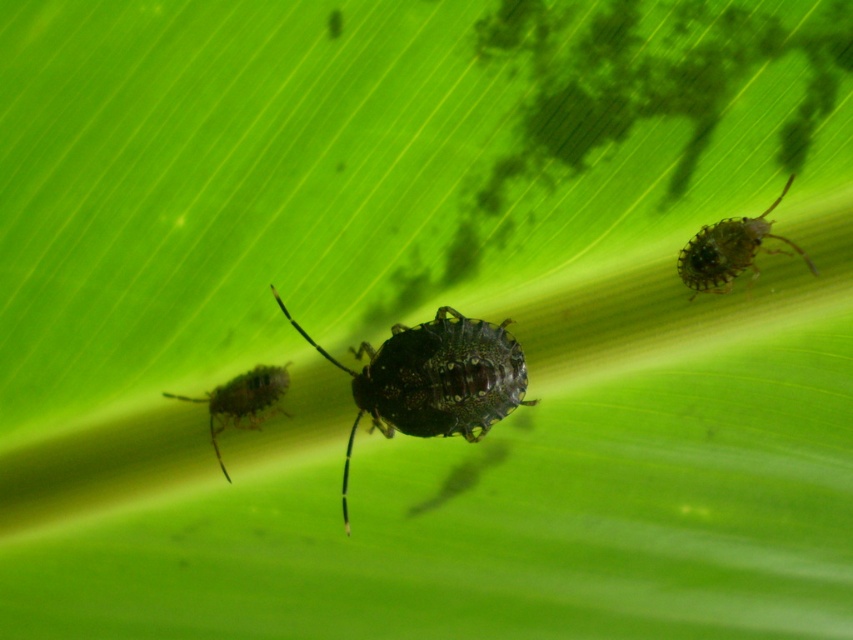
Question: Which object is farther from the camera taking this photo?

Choices:
 (A) shiny brown bug at lower left
 (B) shiny dark green bug at upper right

Answer: (A)

Question: Is shiny dark green bug at upper right further to camera compared to shiny brown bug at lower left?

Choices:
 (A) yes
 (B) no

Answer: (B)

Question: Can you confirm if shiny dark green bug at center is wider than shiny brown bug at lower left?

Choices:
 (A) no
 (B) yes

Answer: (B)

Question: Which point appears closest to the camera in this image?

Choices:
 (A) (270, 385)
 (B) (508, 371)
 (C) (689, 273)

Answer: (C)

Question: Which object is closer to the camera taking this photo?

Choices:
 (A) shiny brown bug at lower left
 (B) shiny dark green bug at upper right

Answer: (B)

Question: Can you confirm if shiny dark green bug at upper right is positioned to the left of shiny brown bug at lower left?

Choices:
 (A) yes
 (B) no

Answer: (B)